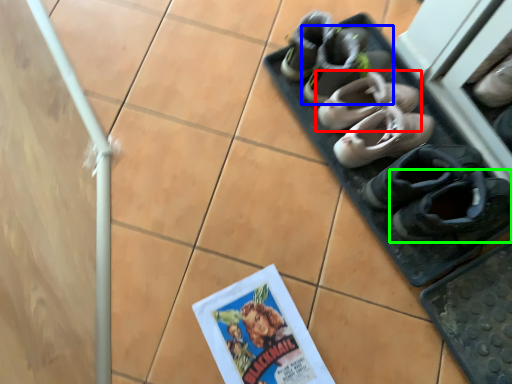
Question: Which object is the farthest from footwear (highlighted by a red box)? Choose among these: footwear (highlighted by a blue box) or footwear (highlighted by a green box).

Choices:
 (A) footwear
 (B) footwear

Answer: (B)